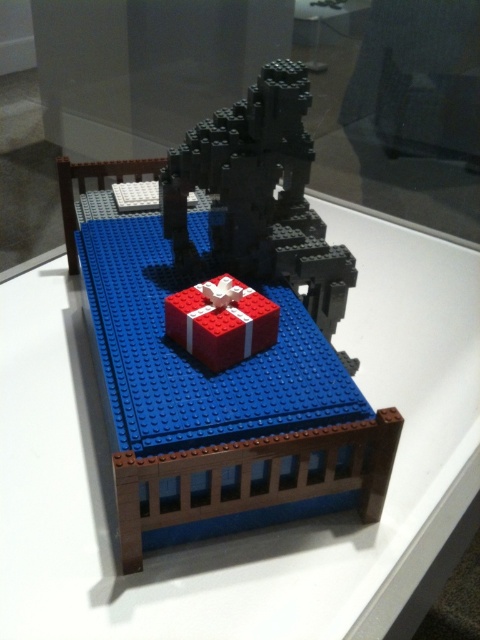
Is point (252, 588) positioned in front of point (178, 308)?

Yes, it is in front of point (178, 308).

Describe the element at coordinates (257, 531) in the screenshot. I see `transparent glass bed at center` at that location.

Which is behind, point (425, 435) or point (171, 320)?

Positioned behind is point (425, 435).

This screenshot has width=480, height=640. In order to click on transparent glass bed at center in this screenshot , I will do `click(257, 531)`.